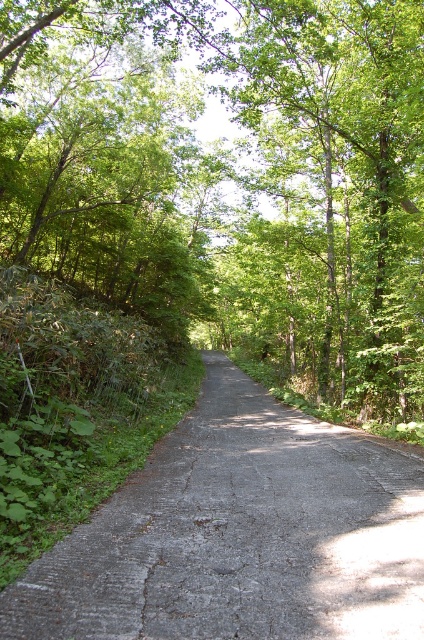
You are a hiker standing on the gray asphalt road at center and want to reach the green leafy tree at center. Which direction should you move to get closer to the tree?

The green leafy tree at center is further to the viewer than the gray asphalt road at center, so you are already standing closer to the tree. To reach it, you should move forward along the road towards the tree.

You are a hiker trying to determine the best path through the forest. You see a green leafy tree at center and a gray asphalt road at center. Which object is taller, and how might that affect your route?

The green leafy tree at center is much taller than the gray asphalt road at center. This means the tree could potentially block the road or require you to navigate around it, so you should plan your route accordingly to avoid obstacles.

You are driving a car that is 2 meters wide and want to pass through the narrow road. The green leafy tree at center and the gray asphalt road at center are in your path. Can you safely navigate between them without hitting the tree?

The green leafy tree at center is to the left of gray asphalt road at center, so the road itself is the path you should follow. Since the road is made of asphalt and is the designated path for vehicles, you can safely drive along the gray asphalt road at center without hitting the tree as long as you stay on the road. The tree is positioned to the left side of the road, so maintaining your position on the road should keep you clear of the tree.